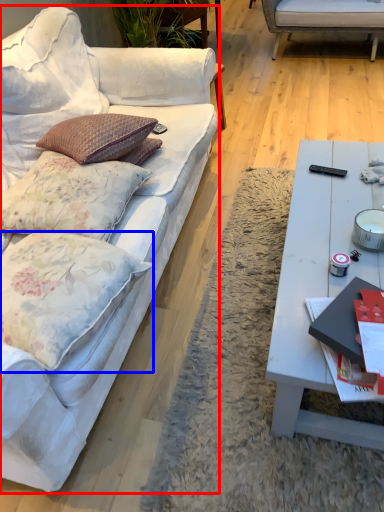
Question: Which point is further to the camera, studio couch (highlighted by a red box) or pillow (highlighted by a blue box)?

Choices:
 (A) studio couch
 (B) pillow

Answer: (B)